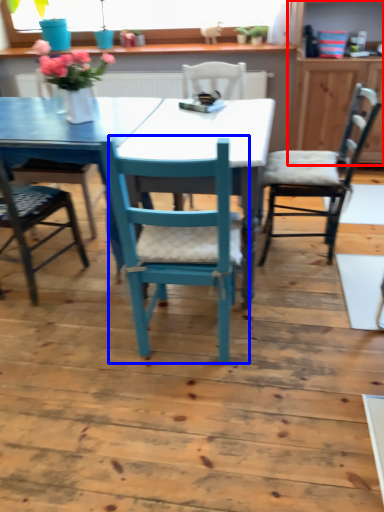
Question: Which point is closer to the camera, dresser (highlighted by a red box) or chair (highlighted by a blue box)?

Choices:
 (A) dresser
 (B) chair

Answer: (B)